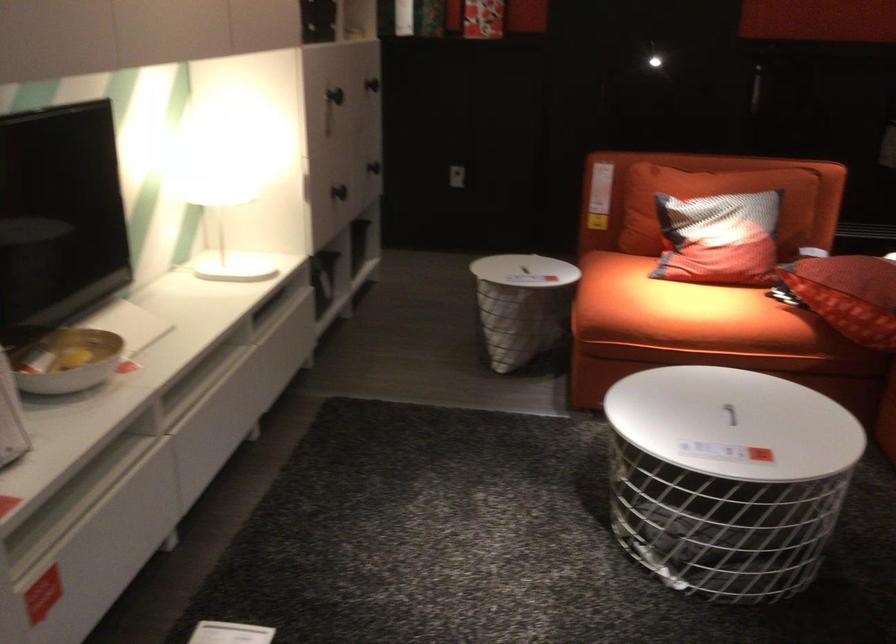
The image size is (896, 644). I want to click on red and black pillow, so click(x=719, y=239).